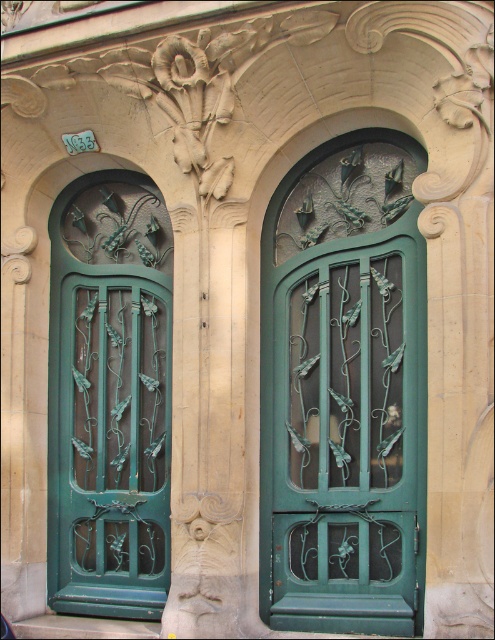
In the scene shown: Is green wrought iron door at center bigger than green wrought iron door at left?

Indeed, green wrought iron door at center has a larger size compared to green wrought iron door at left.

Who is lower down, green wrought iron door at center or green wrought iron door at left?

green wrought iron door at left

Is point (394, 189) positioned before point (98, 524)?

Yes, it is in front of point (98, 524).

Where is `green wrought iron door at center`? This screenshot has height=640, width=495. green wrought iron door at center is located at coordinates (344, 392).